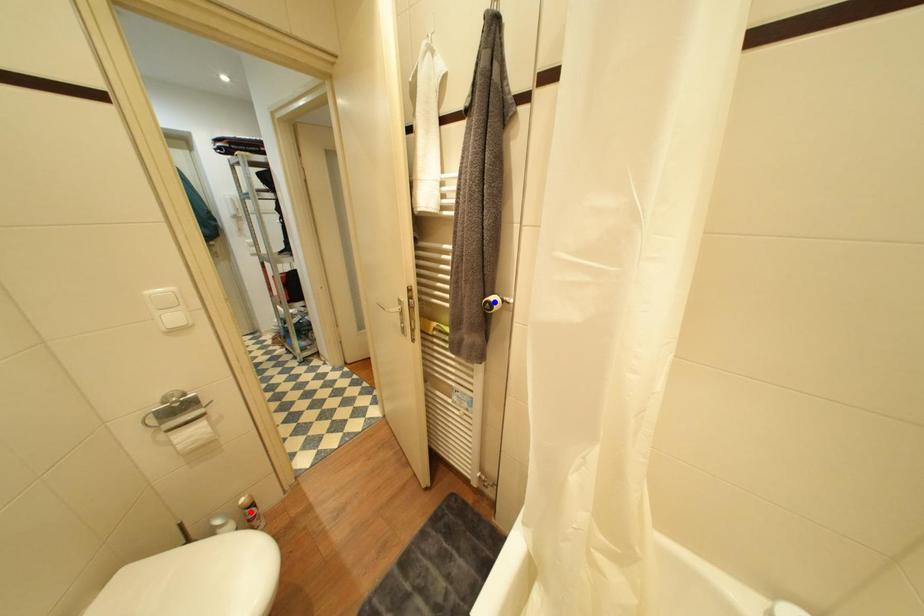
Question: In the image, two points are highlighted. Which point is nearer to the camera? Reply with the corresponding letter.

Choices:
 (A) blue point
 (B) red point

Answer: (A)